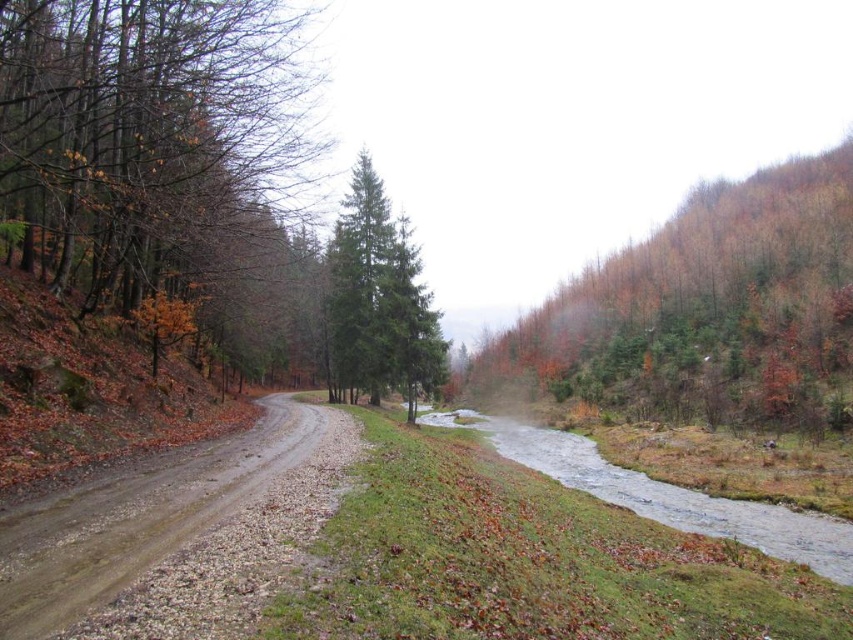
Which is below, brown gravel road at left or green matte tree at center?

brown gravel road at left is below.

Between brown gravel road at left and green matte tree at center, which one appears on the right side from the viewer's perspective?

brown gravel road at left is more to the right.

Is point (271, 492) in front of point (442, 364)?

Yes.

Identify the location of brown gravel road at left. This screenshot has height=640, width=853. (165, 524).

Is brown matte tree at left wider than clear water at center?

A: No, brown matte tree at left is not wider than clear water at center.

Is brown matte tree at left shorter than clear water at center?

No, brown matte tree at left is not shorter than clear water at center.

Describe the element at coordinates (154, 132) in the screenshot. I see `brown matte tree at left` at that location.

Identify the location of brown matte tree at left. (154, 132).

Which is above, brown matte tree at left or green matte tree at center?

Positioned higher is brown matte tree at left.

Is brown matte tree at left to the right of green matte tree at center from the viewer's perspective?

No, brown matte tree at left is not to the right of green matte tree at center.

At what (x,y) coordinates should I click in order to perform the action: click on brown matte tree at left. Please return your answer as a coordinate pair (x, y). This screenshot has height=640, width=853. Looking at the image, I should click on (154, 132).

You are a GUI agent. You are given a task and a screenshot of the screen. Output one action in this format:
    pyautogui.click(x=<x>, y=<y>)
    Task: Click on the brown matte tree at left
    The image size is (853, 640).
    Given the screenshot: What is the action you would take?
    pyautogui.click(x=154, y=132)